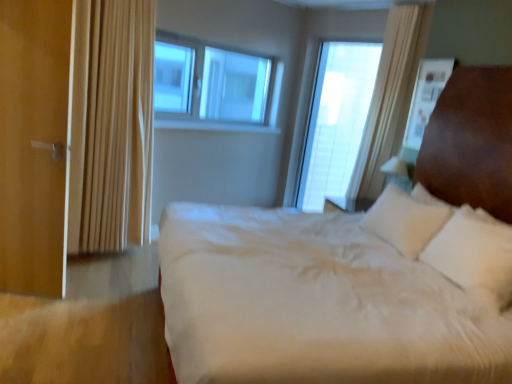
The width and height of the screenshot is (512, 384). Describe the element at coordinates (33, 145) in the screenshot. I see `matte wood door at left` at that location.

I want to click on beige fabric curtain at left, so click(x=112, y=126).

From a real-world perspective, is beige fabric curtain at left located higher than matte wood door at left?

Yes, from a real-world perspective, beige fabric curtain at left is on top of matte wood door at left.

Between beige fabric curtain at left and matte wood door at left, which one has larger size?

Bigger between the two is beige fabric curtain at left.

Is beige fabric curtain at left to the left of matte wood door at left from the viewer's perspective?

No.

Is point (74, 122) positioned after point (263, 79)?

That is False.

Which of these two, beige fabric curtain at left or transparent glass window at center, arranged as the 2th window when viewed from the right, is smaller?

transparent glass window at center, arranged as the 2th window when viewed from the right.

Considering their positions, is beige fabric curtain at left located in front of or behind transparent glass window at center, arranged as the 2th window when viewed from the right?

beige fabric curtain at left is positioned closer to the viewer than transparent glass window at center, arranged as the 2th window when viewed from the right.

Does beige fabric curtain at left appear on the right side of transparent glass window at center, arranged as the 2th window when viewed from the right?

In fact, beige fabric curtain at left is to the left of transparent glass window at center, arranged as the 2th window when viewed from the right.

Between white soft bed at center and transparent glass window at center, placed as the first window when sorted from right to left, which one is positioned in front?

white soft bed at center is closer to the camera.

From the image's perspective, which object appears higher, white soft bed at center or transparent glass window at center, placed as the first window when sorted from right to left?

From the image's view, transparent glass window at center, placed as the first window when sorted from right to left, is above.

Considering the sizes of objects white soft bed at center and transparent glass window at center, placed as the first window when sorted from right to left, in the image provided, who is smaller, white soft bed at center or transparent glass window at center, placed as the first window when sorted from right to left,?

transparent glass window at center, placed as the first window when sorted from right to left.

Could transparent glass window at center, placed as the first window when sorted from right to left, be considered to be inside white soft bed at center?

No, transparent glass window at center, placed as the first window when sorted from right to left, is located outside of white soft bed at center.

Who is taller, transparent glass window at center, which ranks as the 2th window in left-to-right order, or white soft bed at center?

Standing taller between the two is transparent glass window at center, which ranks as the 2th window in left-to-right order.

This screenshot has height=384, width=512. I want to click on the 1st window positioned above the white soft bed at center (from a real-world perspective), so click(336, 120).

Is transparent glass window at center, placed as the first window when sorted from right to left, in contact with white soft bed at center?

No, transparent glass window at center, placed as the first window when sorted from right to left, is not next to white soft bed at center.

Which is behind, transparent glass window at center, placed as the first window when sorted from right to left, or white soft bed at center?

transparent glass window at center, placed as the first window when sorted from right to left, is further from the camera.

Is transparent glass window at center, which ranks as the first window in left-to-right order, aimed at white soft bed at center?

No, transparent glass window at center, which ranks as the first window in left-to-right order, is not oriented towards white soft bed at center.

Is transparent glass window at center, arranged as the 2th window when viewed from the right, further to camera compared to white soft bed at center?

Yes, it is behind white soft bed at center.

What's the angular difference between transparent glass window at center, which ranks as the first window in left-to-right order, and white soft bed at center's facing directions?

They differ by 120 degrees in their facing directions.

From a real-world perspective, count 2nd windows upward from the white soft bed at center and point to it. Please provide its 2D coordinates.

[(214, 83)]

Is matte wood door at left oriented towards transparent glass window at center, which ranks as the 2th window in left-to-right order?

No, matte wood door at left is not facing towards transparent glass window at center, which ranks as the 2th window in left-to-right order.

Who is shorter, matte wood door at left or transparent glass window at center, which ranks as the 2th window in left-to-right order?

Standing shorter between the two is matte wood door at left.

Based on their sizes in the image, would you say matte wood door at left is bigger or smaller than transparent glass window at center, which ranks as the 2th window in left-to-right order?

In the image, matte wood door at left appears to be smaller than transparent glass window at center, which ranks as the 2th window in left-to-right order.

From the image's perspective, is matte wood door at left below transparent glass window at center, which ranks as the 2th window in left-to-right order?

Yes.

Is matte wood door at left beside beige fabric curtain at left?

matte wood door at left and beige fabric curtain at left are not in contact.

Identify the location of curtain above the matte wood door at left (from a real-world perspective). (112, 126).

Is point (24, 146) closer to camera compared to point (108, 222)?

Yes.

From the image's perspective, which object appears higher, matte wood door at left or beige fabric curtain at left?

beige fabric curtain at left appears higher in the image.

Identify the location of screen door below the beige fabric curtain at left (from a real-world perspective). (33, 145).

Where is `curtain in front of the transparent glass window at center, arranged as the 2th window when viewed from the right`? This screenshot has height=384, width=512. curtain in front of the transparent glass window at center, arranged as the 2th window when viewed from the right is located at coordinates (112, 126).

Looking at the image, which one is located closer to beige fabric curtain at left, transparent glass window at center, which ranks as the 2th window in left-to-right order, or transparent glass window at center, which ranks as the first window in left-to-right order?

The object closer to beige fabric curtain at left is transparent glass window at center, which ranks as the first window in left-to-right order.

From the image, which object appears to be farther from transparent glass window at center, arranged as the 2th window when viewed from the right, beige fabric curtain at left or white soft bed at center?

The object further to transparent glass window at center, arranged as the 2th window when viewed from the right, is white soft bed at center.

Which object lies further to the anchor point transparent glass window at center, which ranks as the first window in left-to-right order, beige fabric curtain at left or matte wood door at left?

Among the two, matte wood door at left is located further to transparent glass window at center, which ranks as the first window in left-to-right order.

Based on their spatial positions, is beige fabric curtain at left or transparent glass window at center, which ranks as the 2th window in left-to-right order, closer to matte wood door at left?

Among the two, beige fabric curtain at left is located nearer to matte wood door at left.

Estimate the real-world distances between objects in this image. Which object is closer to transparent glass window at center, placed as the first window when sorted from right to left, matte wood door at left or white soft bed at center?

Based on the image, white soft bed at center appears to be nearer to transparent glass window at center, placed as the first window when sorted from right to left.

Looking at the image, which one is located closer to beige fabric curtain at left, white soft bed at center or transparent glass window at center, arranged as the 2th window when viewed from the right?

Among the two, transparent glass window at center, arranged as the 2th window when viewed from the right, is located nearer to beige fabric curtain at left.

In the scene shown: Estimate the real-world distances between objects in this image. Which object is closer to transparent glass window at center, which ranks as the 2th window in left-to-right order, beige fabric curtain at left or transparent glass window at center, arranged as the 2th window when viewed from the right?

Based on the image, transparent glass window at center, arranged as the 2th window when viewed from the right, appears to be nearer to transparent glass window at center, which ranks as the 2th window in left-to-right order.

Estimate the real-world distances between objects in this image. Which object is closer to matte wood door at left, white soft bed at center or transparent glass window at center, which ranks as the first window in left-to-right order?

white soft bed at center.

Where is `screen door between white soft bed at center and transparent glass window at center, placed as the first window when sorted from right to left, along the z-axis`? The height and width of the screenshot is (384, 512). screen door between white soft bed at center and transparent glass window at center, placed as the first window when sorted from right to left, along the z-axis is located at coordinates (33, 145).

This screenshot has height=384, width=512. Identify the location of screen door between white soft bed at center and transparent glass window at center, which ranks as the first window in left-to-right order, in the front-back direction. (33, 145).

Where is `curtain located between white soft bed at center and transparent glass window at center, arranged as the 2th window when viewed from the right, in the depth direction`? curtain located between white soft bed at center and transparent glass window at center, arranged as the 2th window when viewed from the right, in the depth direction is located at coordinates (112, 126).

At what (x,y) coordinates should I click in order to perform the action: click on curtain between matte wood door at left and white soft bed at center. Please return your answer as a coordinate pair (x, y). This screenshot has height=384, width=512. Looking at the image, I should click on (112, 126).